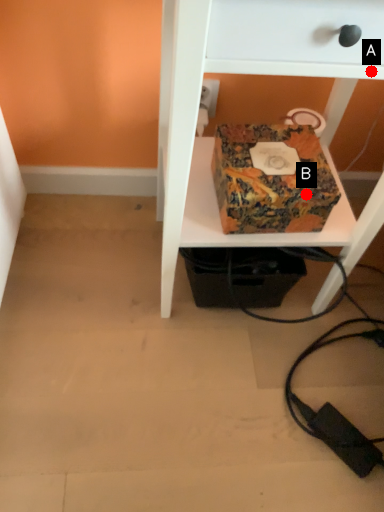
Question: Two points are circled on the image, labeled by A and B beside each circle. Which point is closer to the camera?

Choices:
 (A) A is closer
 (B) B is closer

Answer: (A)